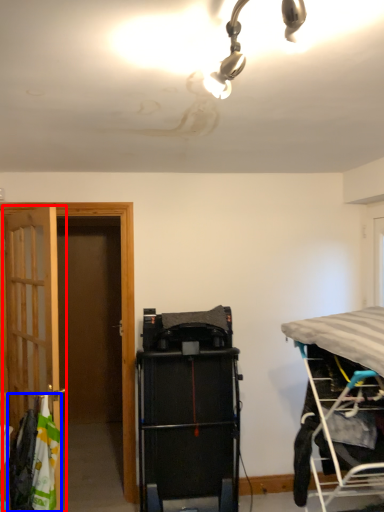
Question: Which point is further to the camera, door (highlighted by a red box) or laundry (highlighted by a blue box)?

Choices:
 (A) door
 (B) laundry

Answer: (A)